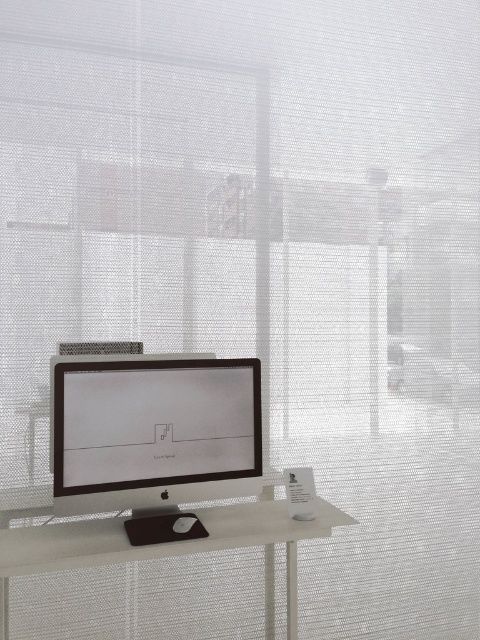
Who is taller, matte black monitor at center or white matte computer desk at center?

white matte computer desk at center

Based on the photo, which of these two, matte black monitor at center or white matte computer desk at center, stands shorter?

matte black monitor at center

Who is more distant from viewer, (93, 476) or (9, 566)?

Positioned behind is point (93, 476).

Locate an element on the screen. The height and width of the screenshot is (640, 480). matte black monitor at center is located at coordinates (155, 422).